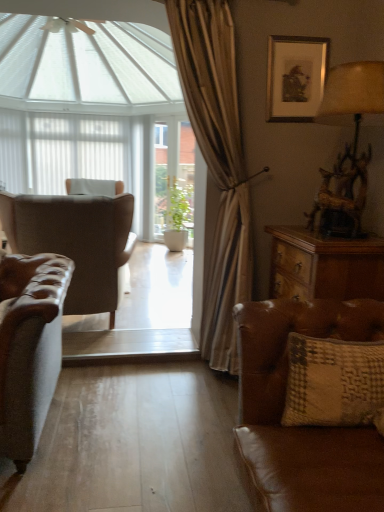
Question: Does silver metallic picture frame at upper right lie in front of green matte plant at center?

Choices:
 (A) no
 (B) yes

Answer: (B)

Question: Can you confirm if silver metallic picture frame at upper right is wider than green matte plant at center?

Choices:
 (A) no
 (B) yes

Answer: (A)

Question: Does silver metallic picture frame at upper right have a smaller size compared to green matte plant at center?

Choices:
 (A) no
 (B) yes

Answer: (B)

Question: Is silver metallic picture frame at upper right aimed at green matte plant at center?

Choices:
 (A) no
 (B) yes

Answer: (A)

Question: From a real-world perspective, is silver metallic picture frame at upper right beneath green matte plant at center?

Choices:
 (A) yes
 (B) no

Answer: (B)

Question: From a real-world perspective, is silver metallic picture frame at upper right on green matte plant at center?

Choices:
 (A) yes
 (B) no

Answer: (A)

Question: From a real-world perspective, is textured beige pillow at lower right physically above white sheer curtain at upper center?

Choices:
 (A) no
 (B) yes

Answer: (A)

Question: Is textured beige pillow at lower right smaller than white sheer curtain at upper center?

Choices:
 (A) no
 (B) yes

Answer: (B)

Question: Does textured beige pillow at lower right have a lesser width compared to white sheer curtain at upper center?

Choices:
 (A) yes
 (B) no

Answer: (B)

Question: Does textured beige pillow at lower right have a greater width compared to white sheer curtain at upper center?

Choices:
 (A) yes
 (B) no

Answer: (A)

Question: Considering the relative positions of textured beige pillow at lower right and white sheer curtain at upper center in the image provided, is textured beige pillow at lower right to the left of white sheer curtain at upper center from the viewer's perspective?

Choices:
 (A) no
 (B) yes

Answer: (A)

Question: Can you confirm if textured beige pillow at lower right is shorter than white sheer curtain at upper center?

Choices:
 (A) no
 (B) yes

Answer: (B)

Question: Considering the relative sizes of white sheer curtain at upper center and white matte shutter at left in the image provided, is white sheer curtain at upper center shorter than white matte shutter at left?

Choices:
 (A) no
 (B) yes

Answer: (A)